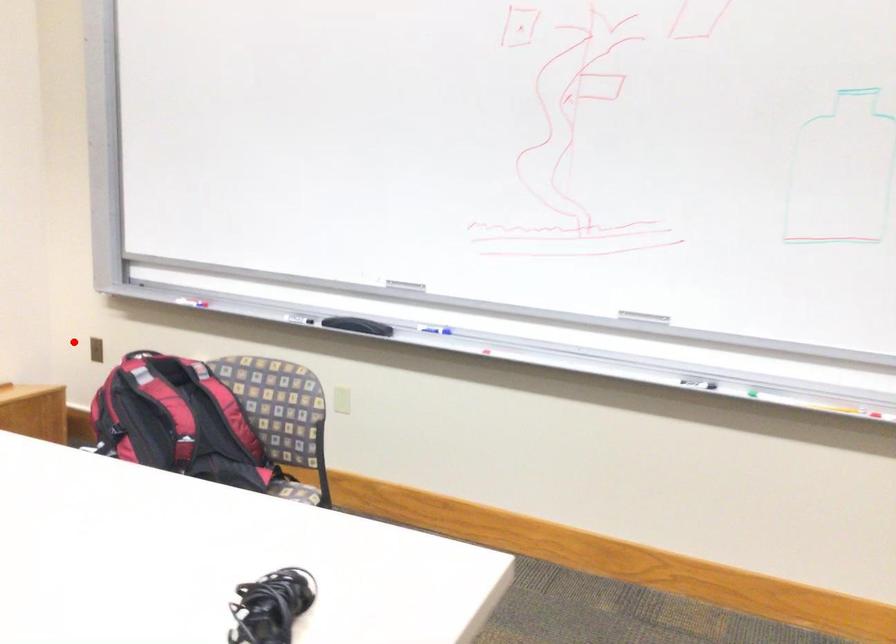
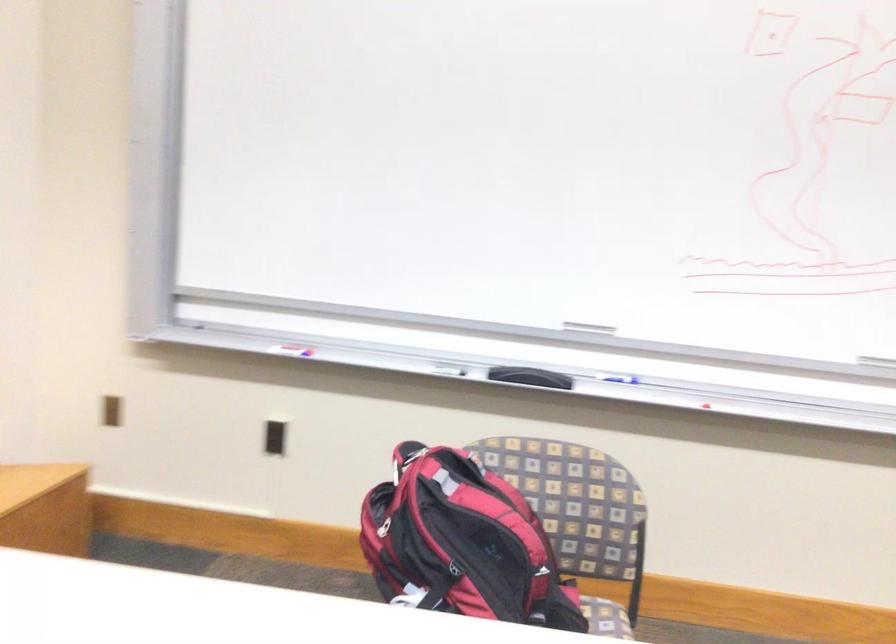
Question: I am providing you with two images of the same scene from different viewpoints. Given a red point in image1, look at the same physical point in image2. Is it:

Choices:
 (A) Closer to the viewpoint
 (B) Farther from the viewpoint

Answer: (A)